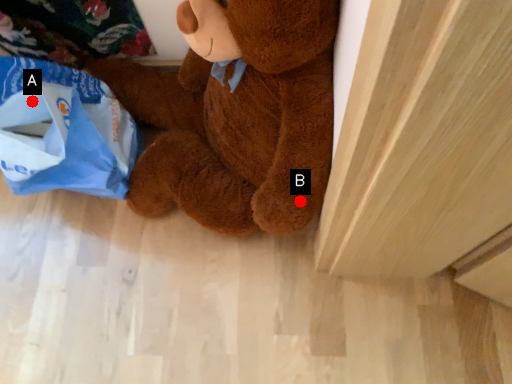
Question: Two points are circled on the image, labeled by A and B beside each circle. Which point is closer to the camera?

Choices:
 (A) A is closer
 (B) B is closer

Answer: (B)